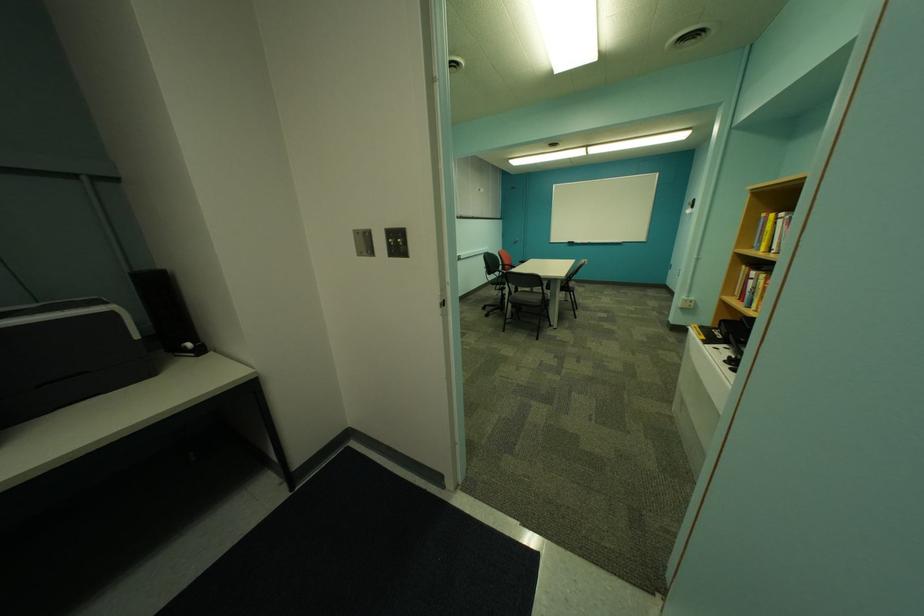
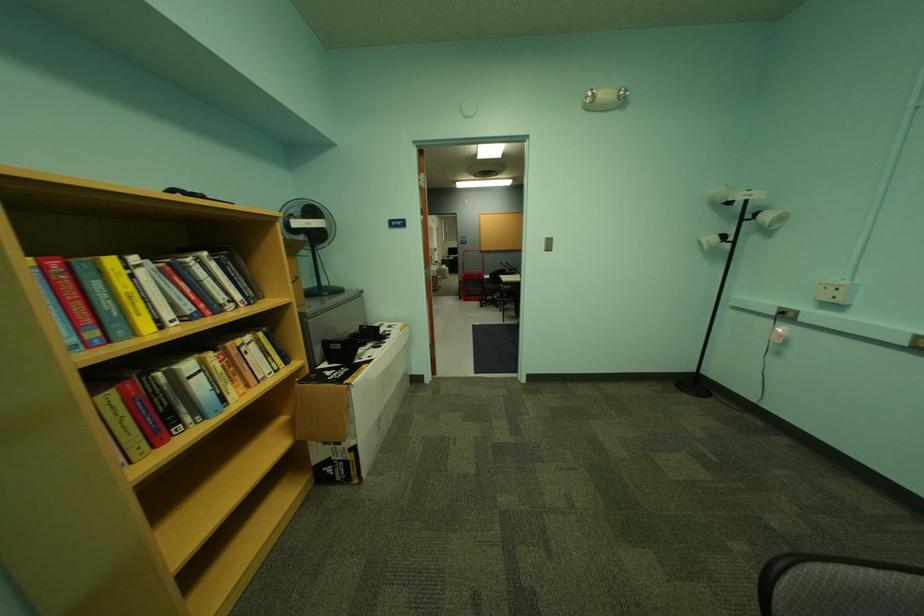
Where in the second image is the point corresponding to point 784,225 from the first image?

(140, 278)